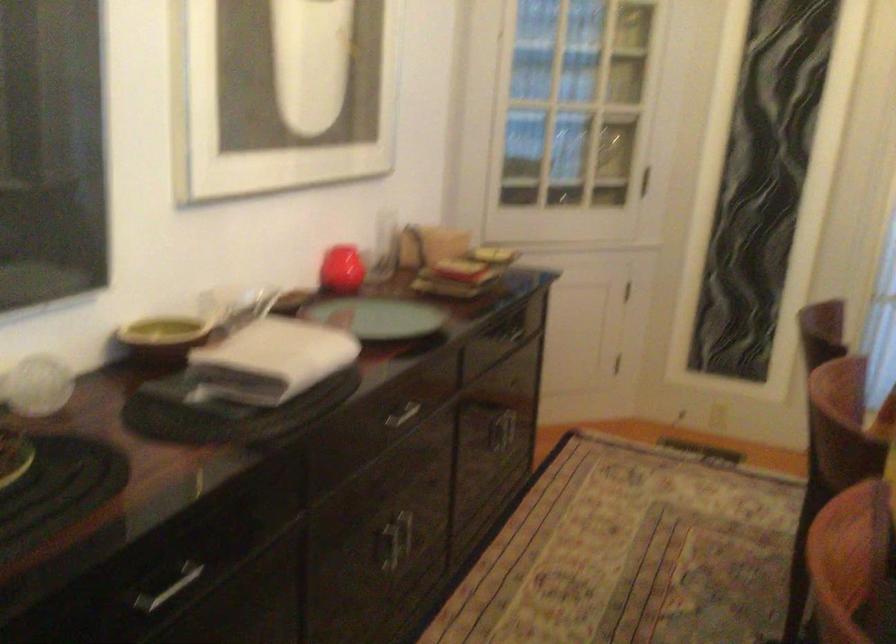
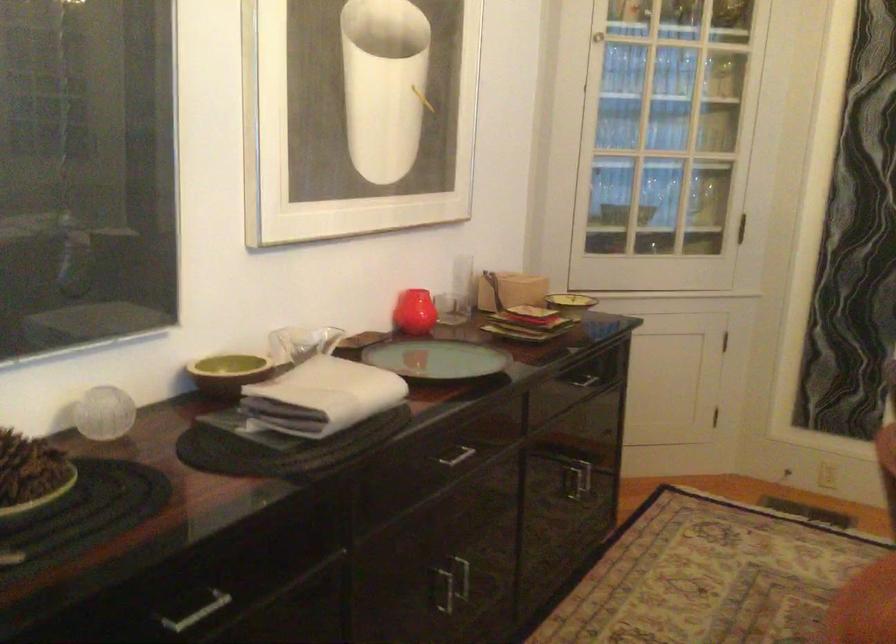
Locate, in the second image, the point that corresponds to (374,317) in the first image.

(436, 359)